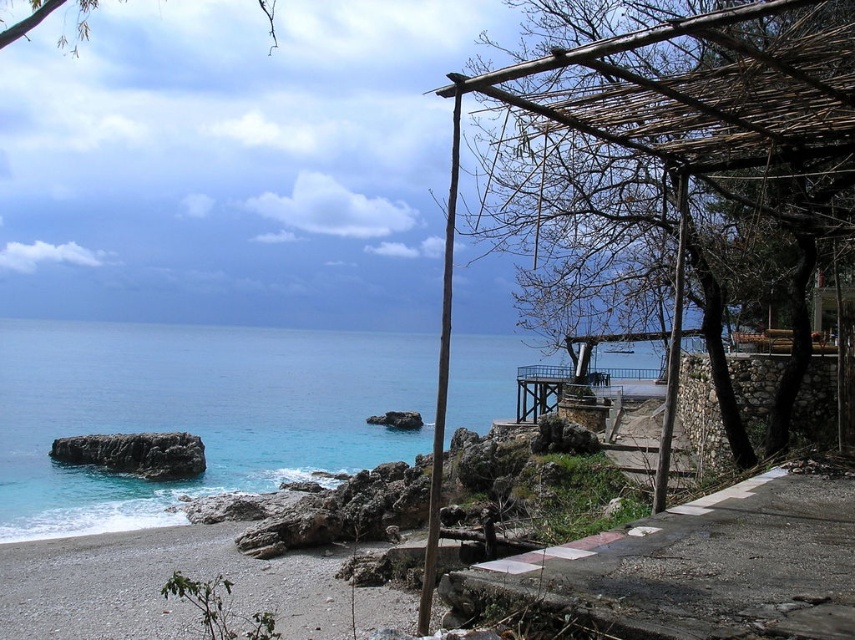
Can you confirm if gray gravel beach at lower left is bigger than dark gray rock at lower left?

Yes.

From the picture: Does gray gravel beach at lower left have a smaller size compared to dark gray rock at lower left?

Actually, gray gravel beach at lower left might be larger than dark gray rock at lower left.

The image size is (855, 640). What do you see at coordinates (158, 586) in the screenshot?
I see `gray gravel beach at lower left` at bounding box center [158, 586].

The height and width of the screenshot is (640, 855). I want to click on gray gravel beach at lower left, so click(158, 586).

Is blue water at lower left positioned behind gray gravel beach at lower left?

Yes, blue water at lower left is behind gray gravel beach at lower left.

Does blue water at lower left have a lesser height compared to gray gravel beach at lower left?

In fact, blue water at lower left may be taller than gray gravel beach at lower left.

Who is more distant from viewer, (506, 388) or (160, 621)?

Point (506, 388)

I want to click on blue water at lower left, so click(195, 412).

Does blue water at lower left have a greater height compared to dark gray rock at lower left?

Yes, blue water at lower left is taller than dark gray rock at lower left.

Does blue water at lower left have a lesser height compared to dark gray rock at lower left?

No.

Where is `blue water at lower left`? The width and height of the screenshot is (855, 640). blue water at lower left is located at coordinates (195, 412).

Locate an element on the screen. blue water at lower left is located at coordinates (195, 412).